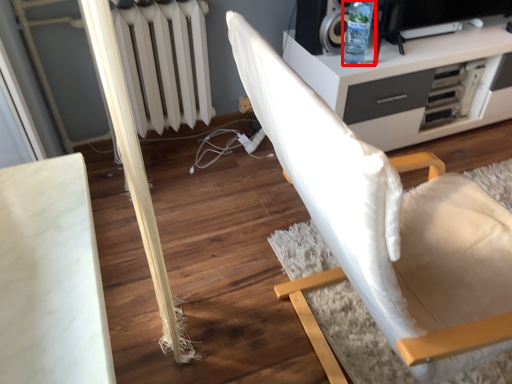
Question: From the image's perspective, where is bottle (annotated by the red box) located in relation to chair in the image?

Choices:
 (A) below
 (B) above

Answer: (B)